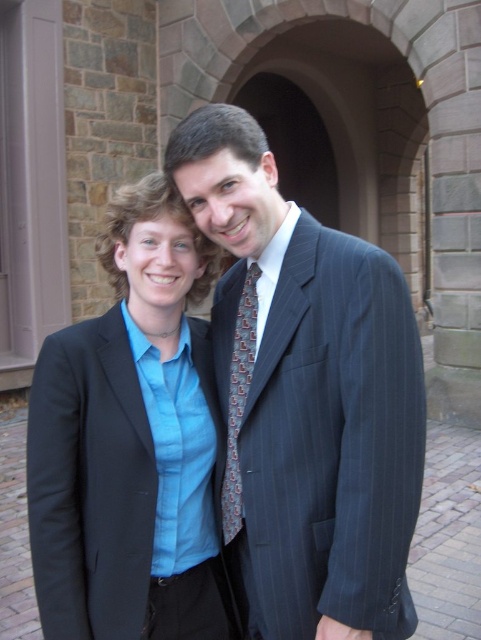
You are a photographer adjusting your camera settings to capture the two people in the scene. You notice the pinstriped suit at center and the patterned silk tie at center. Which object is positioned more to the right side of the image?

The pinstriped suit at center is positioned more to the right side of the image compared to the patterned silk tie at center.

You are a photographer trying to frame a shot of the matte blue shirt at center and the patterned silk tie at center. Which object is wider?

The matte blue shirt at center is wider than the patterned silk tie at center according to the description.